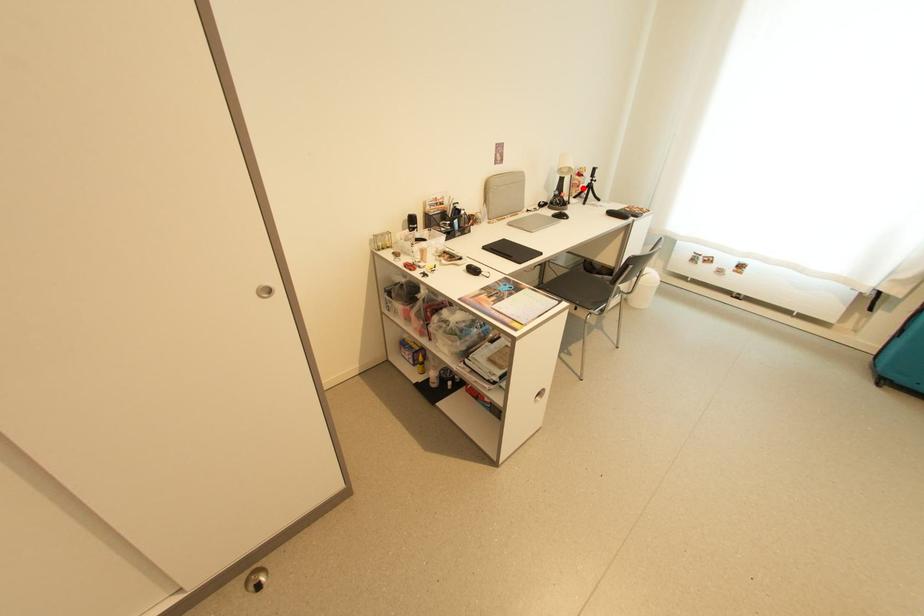
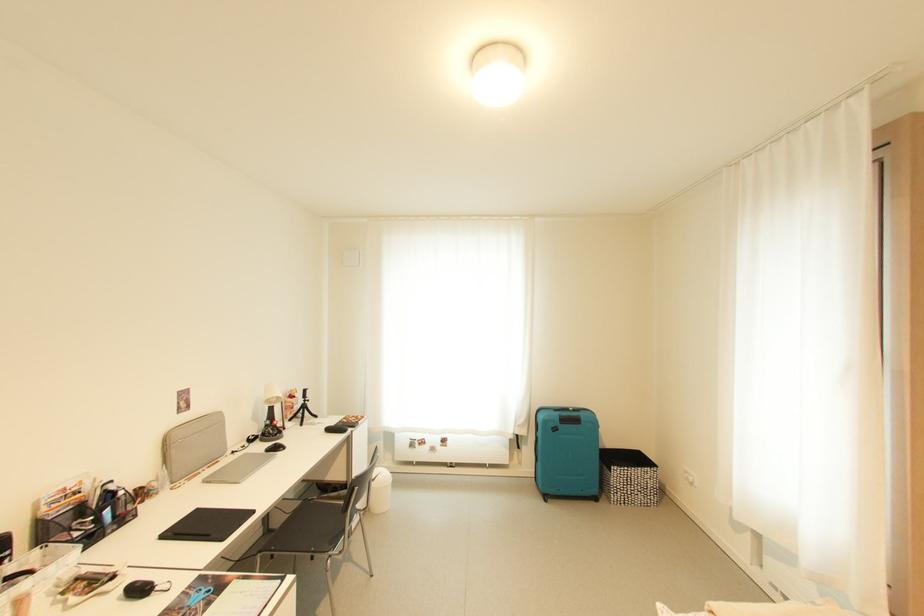
Question: I am providing you with two images of the same scene from different viewpoints. Image1 has a red point marked. In image2, the corresponding 3D location appears at what relative position? Reply with the corresponding letter.

Choices:
 (A) Closer
 (B) Farther

Answer: (B)